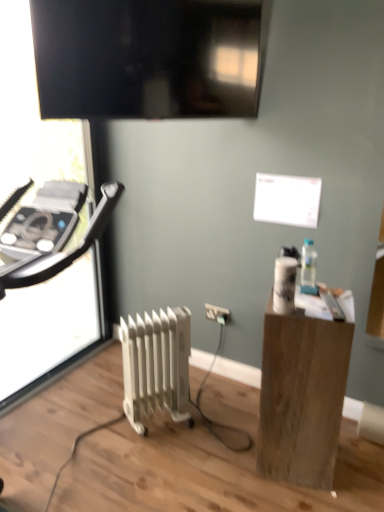
Question: Do you think white plastic electric outlet at center is within transparent glass screen door at left, or outside of it?

Choices:
 (A) outside
 (B) inside

Answer: (A)

Question: Is point (226, 314) closer or farther from the camera than point (54, 147)?

Choices:
 (A) closer
 (B) farther

Answer: (A)

Question: Estimate the real-world distances between objects in this image. Which object is farther from the wooden block at right?

Choices:
 (A) white metallic radiator at center
 (B) matte black tv at upper center
 (C) transparent glass screen door at left
 (D) white plastic electric outlet at center
 (E) clear glass bottle at right

Answer: (C)

Question: Which is nearer to the transparent glass screen door at left?

Choices:
 (A) white metallic radiator at center
 (B) clear glass bottle at right
 (C) matte black tv at upper center
 (D) white plastic electric outlet at center
 (E) wooden block at right

Answer: (C)